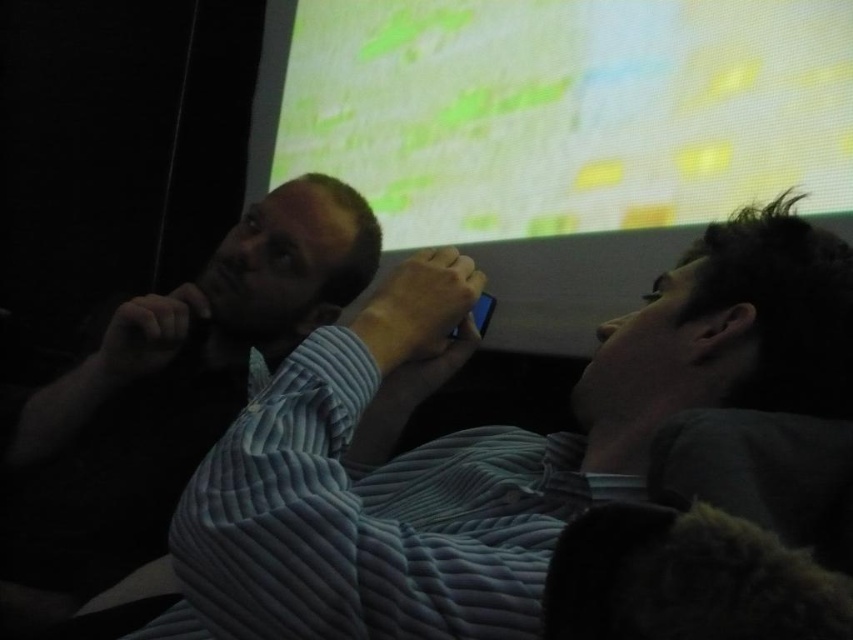
You are a photographer trying to capture a group photo of the blue corduroy shirt at center and the blue striped shirt at left. Since you want both subjects to appear equally tall in the photo, which subject should you position closer to the camera?

The blue corduroy shirt at center has a lesser height compared to the blue striped shirt at left. To make them appear equally tall in the photo, position the blue corduroy shirt at center closer to the camera than the blue striped shirt at left.

You are a photographer in a room where two people are sitting. You need to take a photo of both the blue corduroy shirt at center and the blue striped shirt at left. Which shirt should you focus on to ensure both are in the frame without moving the camera?

The blue corduroy shirt at center is smaller than the blue striped shirt at left, so you should focus on the blue striped shirt at left to ensure both are in the frame without moving the camera.

You are standing in the room and want to hand a document to the person wearing the blue corduroy shirt at center. Based on their position relative to the projection screen, which direction should you approach from?

The blue corduroy shirt at center is located at point (x=483, y=444), so you should approach from the right side of the projection screen to reach them.